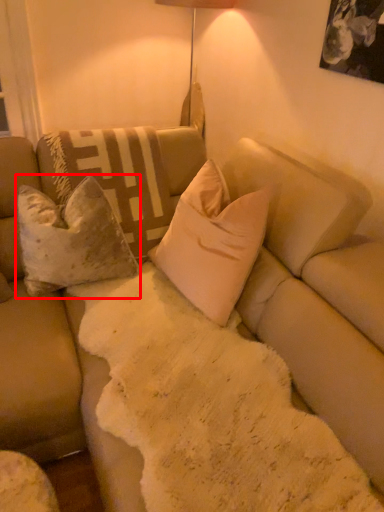
Question: From the image's perspective, what is the correct spatial relationship of pillow (annotated by the red box) in relation to pillow?

Choices:
 (A) below
 (B) above

Answer: (B)